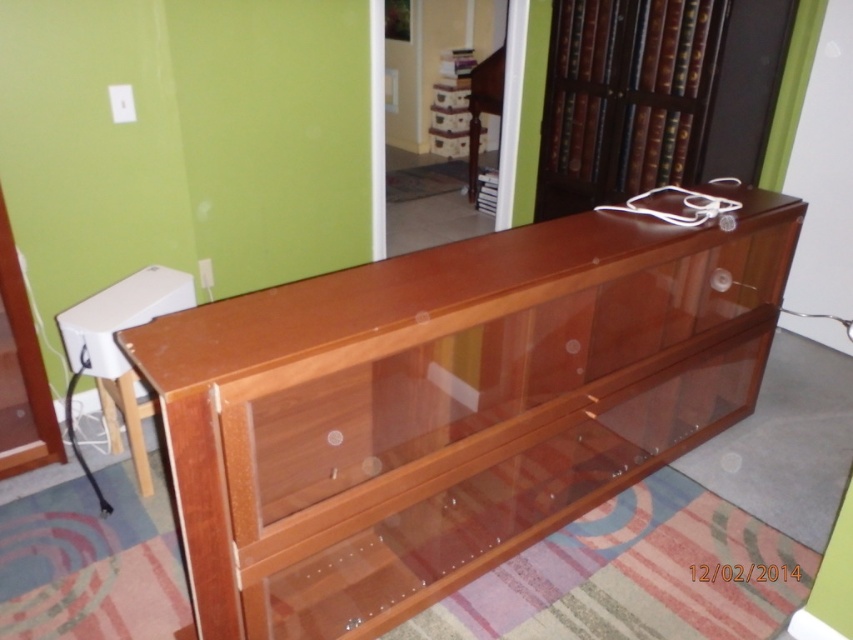
Question: Is glossy wood dresser at center smaller than brown wooden bookshelf at upper right?

Choices:
 (A) no
 (B) yes

Answer: (A)

Question: Which object is farther from the camera taking this photo?

Choices:
 (A) glossy wood dresser at center
 (B) brown wooden bookshelf at upper right

Answer: (B)

Question: Can you confirm if glossy wood dresser at center is positioned above brown wooden bookshelf at upper right?

Choices:
 (A) yes
 (B) no

Answer: (B)

Question: Can you confirm if glossy wood dresser at center is smaller than brown wooden bookshelf at upper right?

Choices:
 (A) no
 (B) yes

Answer: (A)